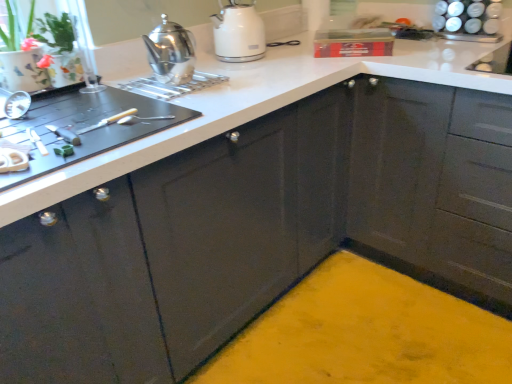
Question: From the image's perspective, does polished stainless steel teapot at upper left, arranged as the first kitchen appliance when viewed from the front, appear lower than textured ceramic pot at upper left?

Choices:
 (A) yes
 (B) no

Answer: (A)

Question: Is polished stainless steel teapot at upper left, arranged as the first kitchen appliance when viewed from the front, oriented away from textured ceramic pot at upper left?

Choices:
 (A) no
 (B) yes

Answer: (A)

Question: From the image's perspective, would you say polished stainless steel teapot at upper left, arranged as the 2th kitchen appliance when viewed from the back, is positioned over textured ceramic pot at upper left?

Choices:
 (A) yes
 (B) no

Answer: (B)

Question: Is polished stainless steel teapot at upper left, arranged as the first kitchen appliance when viewed from the front, wider than textured ceramic pot at upper left?

Choices:
 (A) yes
 (B) no

Answer: (B)

Question: Does polished stainless steel teapot at upper left, arranged as the 2th kitchen appliance when viewed from the back, appear on the left side of textured ceramic pot at upper left?

Choices:
 (A) yes
 (B) no

Answer: (B)

Question: From a real-world perspective, relative to textured ceramic pot at upper left, is white glossy spice rack at upper right vertically above or below?

Choices:
 (A) above
 (B) below

Answer: (B)

Question: Is white glossy spice rack at upper right situated inside textured ceramic pot at upper left or outside?

Choices:
 (A) inside
 (B) outside

Answer: (B)

Question: Considering their positions, is white glossy spice rack at upper right located in front of or behind textured ceramic pot at upper left?

Choices:
 (A) front
 (B) behind

Answer: (B)

Question: From their relative heights in the image, would you say white glossy spice rack at upper right is taller or shorter than textured ceramic pot at upper left?

Choices:
 (A) tall
 (B) short

Answer: (B)

Question: Would you say glossy dark gray cabinet at upper right is to the left or to the right of textured ceramic pot at upper left in the picture?

Choices:
 (A) right
 (B) left

Answer: (A)

Question: Is glossy dark gray cabinet at upper right in front of or behind textured ceramic pot at upper left in the image?

Choices:
 (A) behind
 (B) front

Answer: (B)

Question: Is glossy dark gray cabinet at upper right inside or outside of textured ceramic pot at upper left?

Choices:
 (A) outside
 (B) inside

Answer: (A)

Question: From their relative heights in the image, would you say glossy dark gray cabinet at upper right is taller or shorter than textured ceramic pot at upper left?

Choices:
 (A) tall
 (B) short

Answer: (A)

Question: From the image's perspective, is white glossy spice rack at upper right positioned above or below black rubber cutting board at left?

Choices:
 (A) above
 (B) below

Answer: (A)

Question: Looking at the image, does white glossy spice rack at upper right seem bigger or smaller compared to black rubber cutting board at left?

Choices:
 (A) small
 (B) big

Answer: (A)